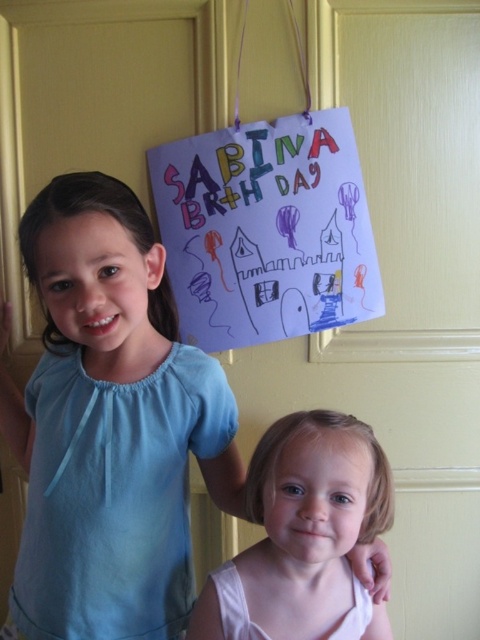
Question: Can you confirm if blue fabric shirt at upper left is positioned to the right of purple paper sign at upper center?

Choices:
 (A) yes
 (B) no

Answer: (B)

Question: Is purple paper sign at upper center positioned at the back of smooth white shirt at lower center?

Choices:
 (A) yes
 (B) no

Answer: (A)

Question: Which object appears farthest from the camera in this image?

Choices:
 (A) smooth white shirt at lower center
 (B) blue fabric shirt at upper left
 (C) purple paper sign at upper center

Answer: (C)

Question: Can you confirm if blue fabric shirt at upper left is smaller than purple paper sign at upper center?

Choices:
 (A) yes
 (B) no

Answer: (B)

Question: Estimate the real-world distances between objects in this image. Which object is closer to the blue fabric shirt at upper left?

Choices:
 (A) purple paper sign at upper center
 (B) smooth white shirt at lower center

Answer: (B)

Question: Which point appears farthest from the camera in this image?

Choices:
 (A) (311, 416)
 (B) (99, 508)
 (C) (316, 244)

Answer: (C)